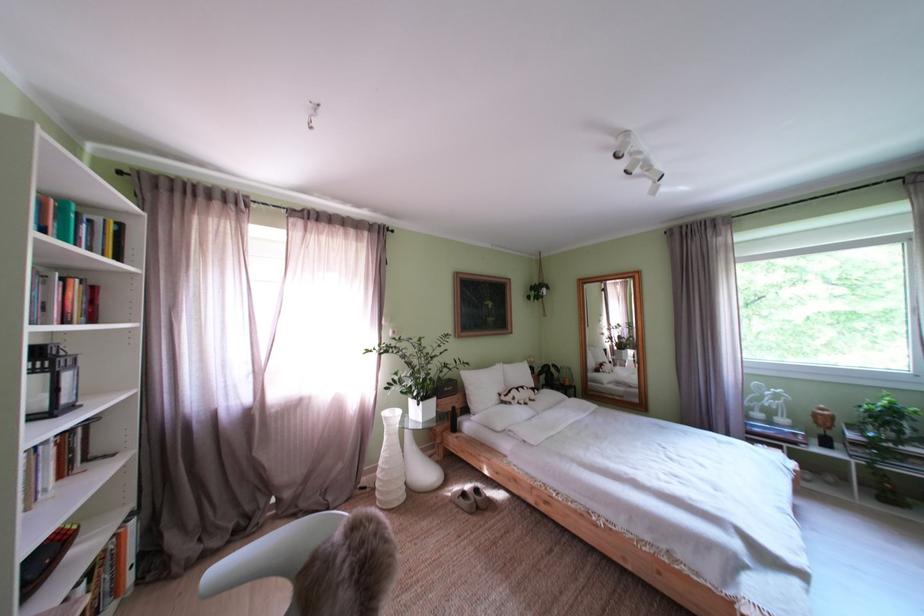
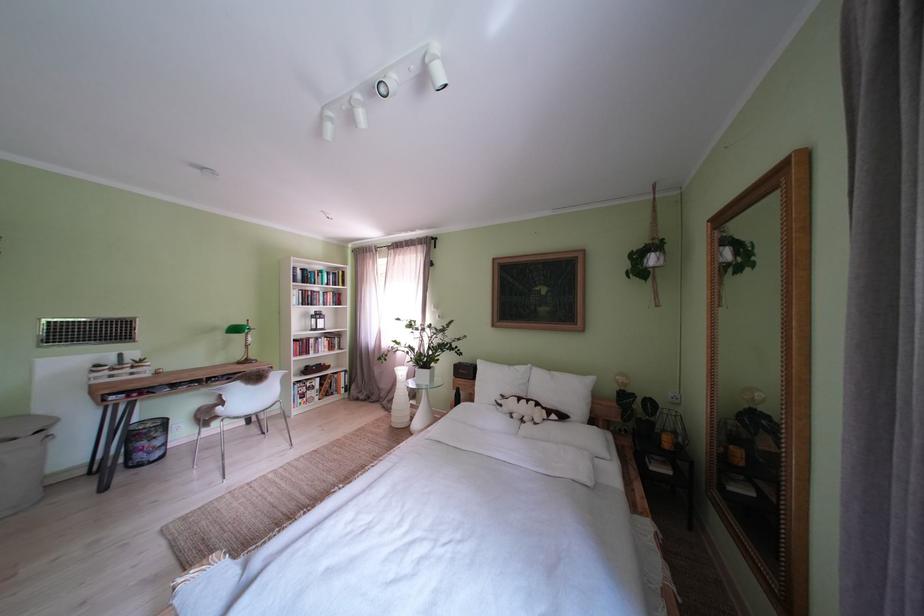
The point at (492, 392) is marked in the first image. Where is the corresponding point in the second image?

(500, 386)